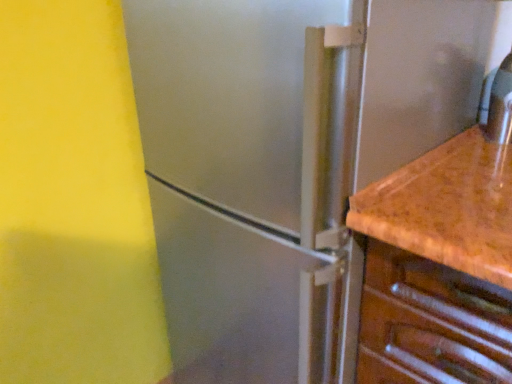
Measure the distance between satin nickel faucet at upper right and camera.

The depth of satin nickel faucet at upper right is 35.53 inches.

Describe the element at coordinates (501, 105) in the screenshot. The height and width of the screenshot is (384, 512). I see `satin nickel faucet at upper right` at that location.

Measure the distance between point (503, 121) and camera.

Point (503, 121) and camera are 36.61 inches apart from each other.

The image size is (512, 384). Identify the location of satin nickel faucet at upper right. (501, 105).

Find the location of `satin nickel faucet at upper right`. satin nickel faucet at upper right is located at coordinates (501, 105).